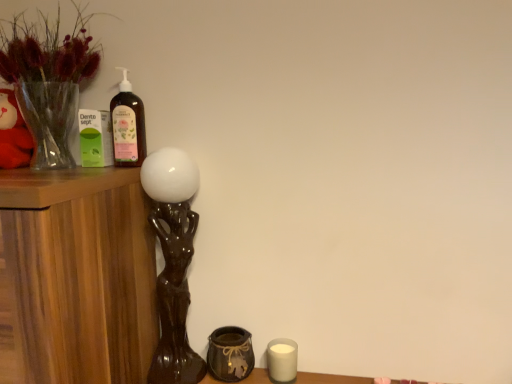
Measure the distance between brown glossy table lamp at left and camera.

The distance of brown glossy table lamp at left from camera is 37.07 inches.

What is the approximate height of brown glossy table lamp at left?

It is 21.15 inches.

What do you see at coordinates (230, 354) in the screenshot? The height and width of the screenshot is (384, 512). I see `brown textured vase at lower center` at bounding box center [230, 354].

In order to click on translucent glass vase at upper left in this screenshot , I will do `click(48, 79)`.

Which point is more forward, (166, 308) or (74, 2)?

The point (166, 308) is closer to the camera.

Looking at this image, is brown glossy table lamp at left not inside translucent glass vase at upper left?

brown glossy table lamp at left is positioned outside translucent glass vase at upper left.

Which object is positioned more to the left, brown glossy table lamp at left or translucent glass vase at upper left?

From the viewer's perspective, translucent glass vase at upper left appears more on the left side.

Is point (42, 31) closer or farther from the camera than point (114, 151)?

Point (42, 31) is positioned closer to the camera compared to point (114, 151).

The width and height of the screenshot is (512, 384). Find the location of `bottle lying on the right of translucent glass vase at upper left`. bottle lying on the right of translucent glass vase at upper left is located at coordinates (127, 125).

Is translucent glass vase at upper left turned away from translucent glass bottle at upper left?

No, translucent glass vase at upper left is not facing away from translucent glass bottle at upper left.

Locate an element on the screen. candle that appears on the right of brown glossy table lamp at left is located at coordinates (282, 360).

In terms of height, does white matte candle at lower right look taller or shorter compared to brown glossy table lamp at left?

Clearly, white matte candle at lower right is shorter compared to brown glossy table lamp at left.

Is white matte candle at lower right at the right side of brown glossy table lamp at left?

Indeed, white matte candle at lower right is positioned on the right side of brown glossy table lamp at left.

From a real-world perspective, is white matte candle at lower right physically located above or below brown glossy table lamp at left?

white matte candle at lower right is situated lower than brown glossy table lamp at left in the real world.

Is white matte candle at lower right not inside brown textured vase at lower center?

Yes.

From the image's perspective, is white matte candle at lower right above or below brown textured vase at lower center?

Clearly, from the image's perspective, white matte candle at lower right is below brown textured vase at lower center.

Considering the positions of objects white matte candle at lower right and brown textured vase at lower center in the image provided, who is more to the left, white matte candle at lower right or brown textured vase at lower center?

brown textured vase at lower center.

What's the angular difference between white matte candle at lower right and brown textured vase at lower center's facing directions?

The angular difference between white matte candle at lower right and brown textured vase at lower center is 0.00685 degrees.

Identify the location of bottle below the translucent glass vase at upper left (from the image's perspective). (127, 125).

Does translucent glass bottle at upper left turn towards translucent glass vase at upper left?

No, translucent glass bottle at upper left is not oriented towards translucent glass vase at upper left.

Are translucent glass bottle at upper left and translucent glass vase at upper left located far from each other?

That's not correct — translucent glass bottle at upper left is a little close to translucent glass vase at upper left.

Which of these two, translucent glass bottle at upper left or translucent glass vase at upper left, stands shorter?

With less height is translucent glass bottle at upper left.

Based on the photo, who is more distant, translucent glass vase at upper left or brown glossy table lamp at left?

Answer: brown glossy table lamp at left is more distant.

From a real-world perspective, relative to brown glossy table lamp at left, is translucent glass vase at upper left vertically above or below?

From a real-world perspective, translucent glass vase at upper left is physically above brown glossy table lamp at left.

Which is behind, point (40, 143) or point (173, 375)?

The point (173, 375) is more distant.

In order to click on bottle above the brown textured vase at lower center (from the image's perspective) in this screenshot , I will do `click(127, 125)`.

Consider the image. Looking at the image, does translucent glass bottle at upper left seem bigger or smaller compared to brown textured vase at lower center?

In the image, translucent glass bottle at upper left appears to be larger than brown textured vase at lower center.

In terms of width, does translucent glass bottle at upper left look wider or thinner when compared to brown textured vase at lower center?

In the image, translucent glass bottle at upper left appears to be more narrow than brown textured vase at lower center.

From the image's perspective, which one is positioned lower, translucent glass bottle at upper left or brown textured vase at lower center?

From the image's view, brown textured vase at lower center is below.

The image size is (512, 384). In order to click on table lamp on the right side of translucent glass vase at upper left in this screenshot , I will do (x=173, y=262).

I want to click on houseplant on the left of translucent glass bottle at upper left, so click(x=48, y=79).

Estimate the real-world distances between objects in this image. Which object is closer to white matte candle at lower right, brown glossy table lamp at left or brown textured vase at lower center?

brown textured vase at lower center lies closer to white matte candle at lower right than the other object.

From the image, which object appears to be nearer to translucent glass bottle at upper left, brown textured vase at lower center or white matte candle at lower right?

brown textured vase at lower center lies closer to translucent glass bottle at upper left than the other object.

Looking at this image, from the image, which object appears to be farther from translucent glass vase at upper left, translucent glass bottle at upper left or white matte candle at lower right?

white matte candle at lower right is positioned further to the anchor translucent glass vase at upper left.

Which object lies nearer to the anchor point translucent glass vase at upper left, white matte candle at lower right or brown textured vase at lower center?

The object closer to translucent glass vase at upper left is brown textured vase at lower center.

Based on their spatial positions, is translucent glass vase at upper left or translucent glass bottle at upper left further from brown textured vase at lower center?

Among the two, translucent glass vase at upper left is located further to brown textured vase at lower center.

Looking at the image, which one is located closer to translucent glass vase at upper left, brown textured vase at lower center or white matte candle at lower right?

brown textured vase at lower center is positioned closer to the anchor translucent glass vase at upper left.

In the scene shown: Which object lies further to the anchor point brown glossy table lamp at left, white matte candle at lower right or translucent glass vase at upper left?

translucent glass vase at upper left.

Looking at the image, which one is located further to translucent glass vase at upper left, brown glossy table lamp at left or brown textured vase at lower center?

The object further to translucent glass vase at upper left is brown textured vase at lower center.

Identify the location of bottle that lies between translucent glass vase at upper left and brown glossy table lamp at left from top to bottom. (127, 125).

Where is `table lamp between translucent glass vase at upper left and brown textured vase at lower center in the vertical direction`? The width and height of the screenshot is (512, 384). table lamp between translucent glass vase at upper left and brown textured vase at lower center in the vertical direction is located at coordinates (173, 262).

The height and width of the screenshot is (384, 512). Identify the location of table lamp between translucent glass bottle at upper left and white matte candle at lower right in the up-down direction. (173, 262).

Identify the location of candle holder between brown glossy table lamp at left and white matte candle at lower right. pos(230,354).